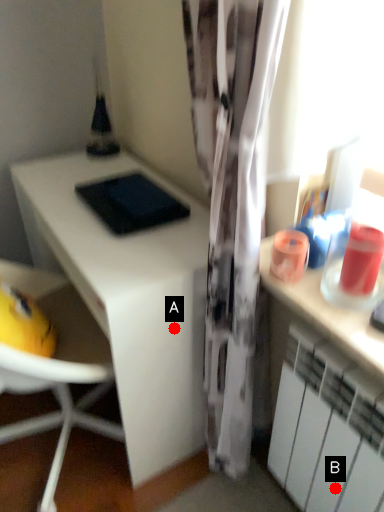
Question: Two points are circled on the image, labeled by A and B beside each circle. Which point appears farthest from the camera in this image?

Choices:
 (A) A is further
 (B) B is further

Answer: (A)